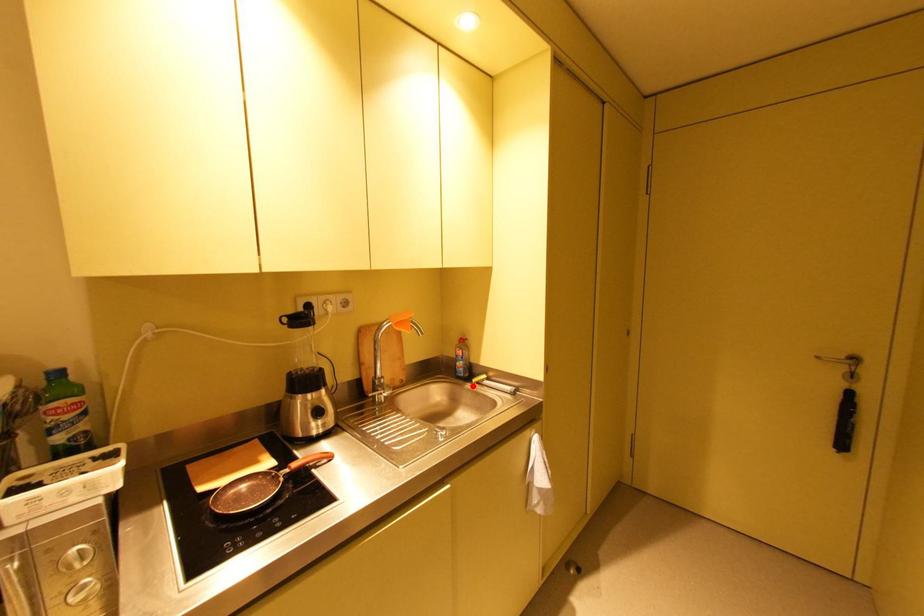
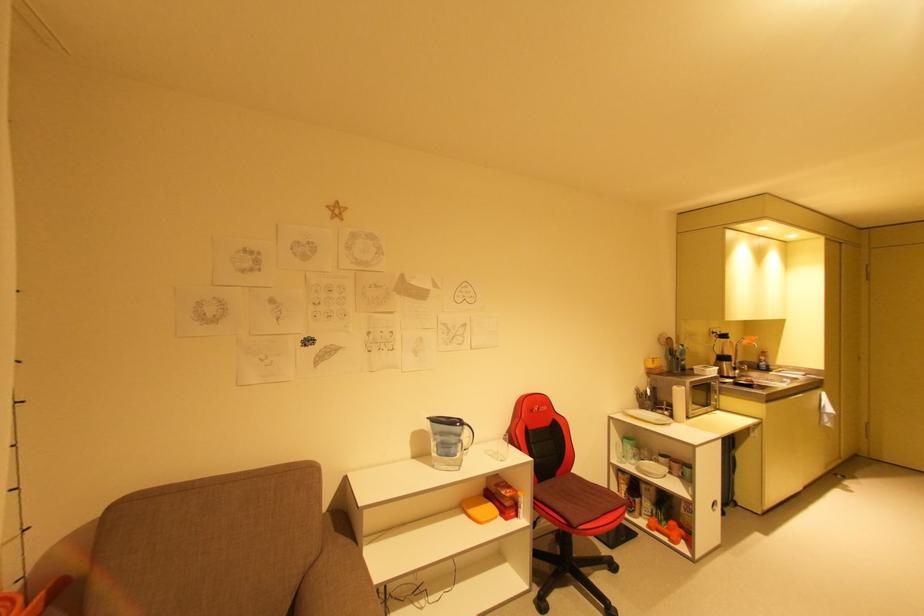
The point at the highlighted location is marked in the first image. Where is the corresponding point in the second image?

(776, 373)